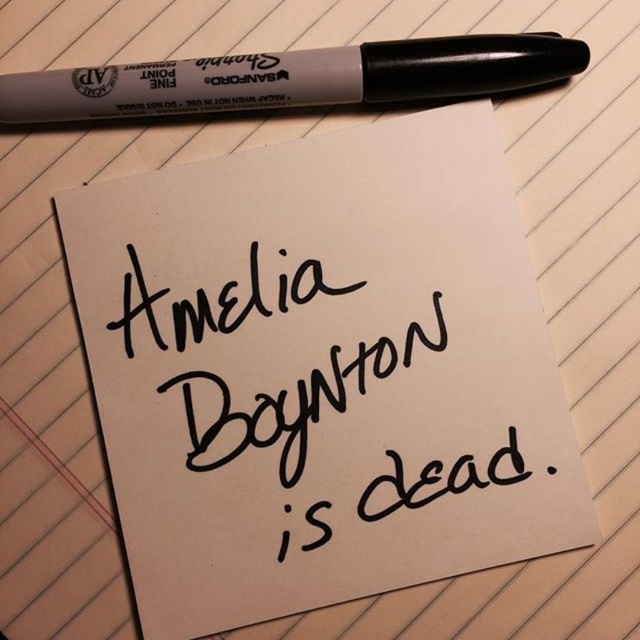
Question: Which object is the closest to the black plastic pen at top?

Choices:
 (A) black handwritten text at center
 (B) white paper at center

Answer: (B)

Question: Is white paper at center below black plastic pen at top?

Choices:
 (A) no
 (B) yes

Answer: (B)

Question: Which of the following is the closest to the observer?

Choices:
 (A) (160, 243)
 (B) (296, 273)
 (C) (410, 72)

Answer: (C)

Question: Is black handwritten text at center to the left of black plastic pen at top from the viewer's perspective?

Choices:
 (A) no
 (B) yes

Answer: (A)

Question: Which object appears closest to the camera in this image?

Choices:
 (A) white paper at center
 (B) black handwritten text at center
 (C) black plastic pen at top

Answer: (C)

Question: Can you confirm if white paper at center is positioned above black handwritten text at center?

Choices:
 (A) yes
 (B) no

Answer: (A)